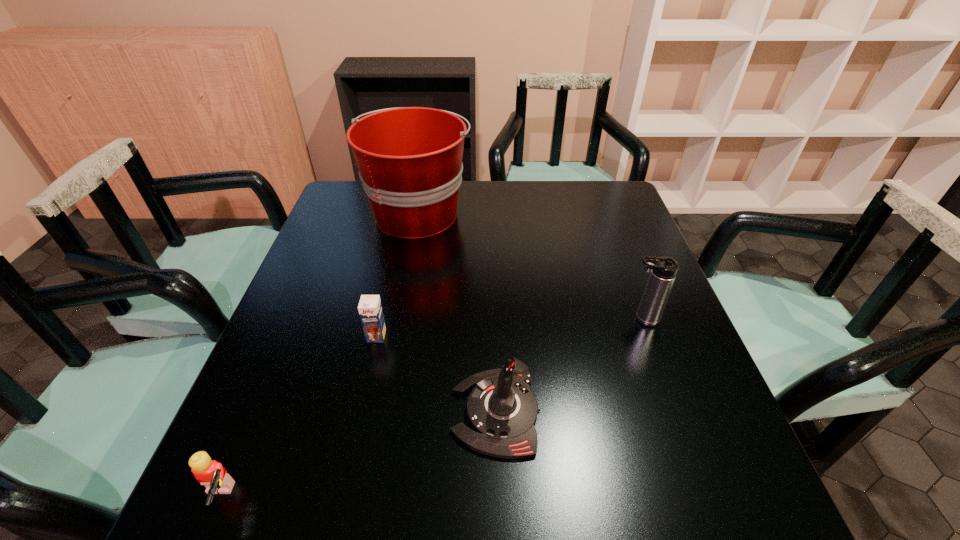
Locate an element on the screen. Image resolution: width=960 pixels, height=540 pixels. vacant area that lies between the joystick and the leftmost object is located at coordinates (356, 455).

Locate an element on the screen. This screenshot has width=960, height=540. free spot between the thermos bottle and the third tallest object is located at coordinates (568, 366).

Where is `free area in between the nearest object and the farthest object`? This screenshot has height=540, width=960. free area in between the nearest object and the farthest object is located at coordinates (318, 356).

Where is `free space between the third shortest object and the leftmost object`? This screenshot has height=540, width=960. free space between the third shortest object and the leftmost object is located at coordinates pyautogui.click(x=356, y=455).

I want to click on free space between the farthest object and the joystick, so click(x=457, y=313).

Image resolution: width=960 pixels, height=540 pixels. I want to click on vacant space that's between the chocolate milk and the leftmost object, so click(297, 417).

Image resolution: width=960 pixels, height=540 pixels. Find the location of `free space between the third shortest object and the bucket`. free space between the third shortest object and the bucket is located at coordinates (457, 313).

Find the location of a particular element. This screenshot has height=540, width=960. vacant space in between the third nearest object and the leftmost object is located at coordinates (297, 417).

You are a GUI agent. You are given a task and a screenshot of the screen. Output one action in this format:
    pyautogui.click(x=<x>, y=<y>)
    Task: Click on the free space between the tallest object and the second farthest object
    
    Given the screenshot: What is the action you would take?
    pyautogui.click(x=530, y=266)

I want to click on free space between the joystick and the thermos bottle, so click(x=568, y=366).